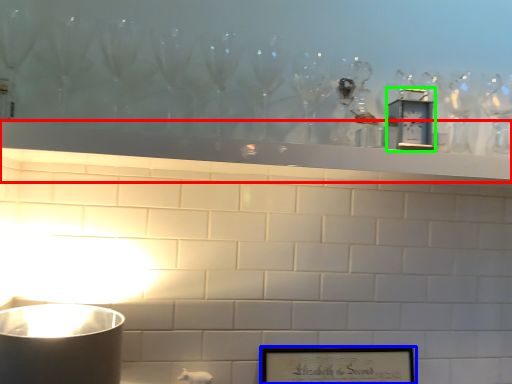
Question: Which object is positioned farthest from mantle (highlighted by a red box)? Select from picture frame (highlighted by a blue box) and clock (highlighted by a green box).

Choices:
 (A) picture frame
 (B) clock

Answer: (A)